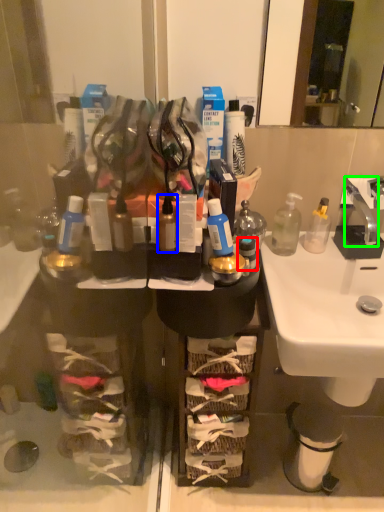
Question: Which object is positioned closest to toiletry (highlighted by a red box)? Select from toiletry (highlighted by a blue box) and faucet (highlighted by a green box).

Choices:
 (A) toiletry
 (B) faucet

Answer: (A)